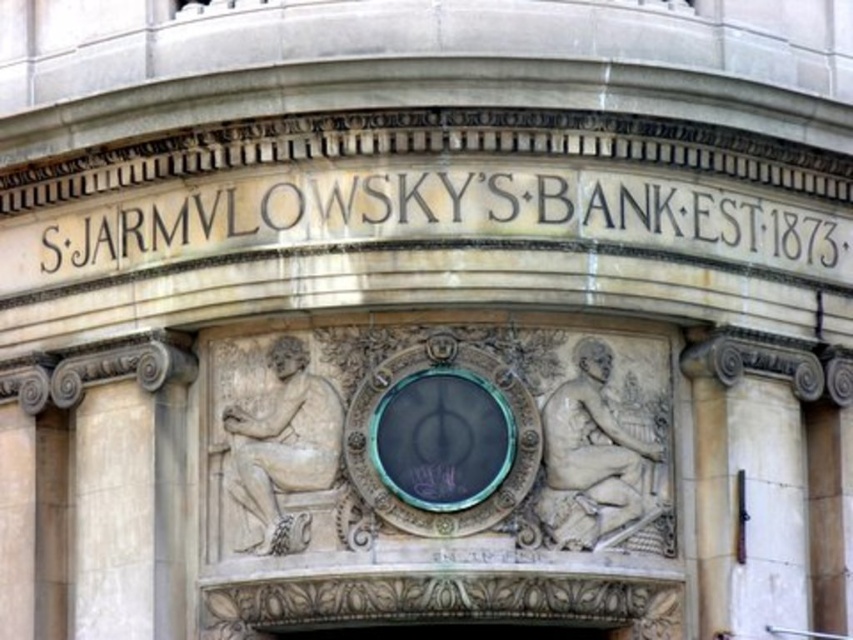
Does green glass clock at center have a lesser width compared to white marble statue at center?

In fact, green glass clock at center might be wider than white marble statue at center.

Which is in front, point (494, 497) or point (305, 541)?

Positioned in front is point (494, 497).

Between point (393, 380) and point (297, 392), which one is positioned behind?

The point (297, 392) is behind.

Locate an element on the screen. This screenshot has height=640, width=853. green glass clock at center is located at coordinates pyautogui.click(x=442, y=438).

Does white marble statue at center have a larger size compared to black glass door at center?

Correct, white marble statue at center is larger in size than black glass door at center.

Does white marble statue at center appear under black glass door at center?

No, white marble statue at center is not below black glass door at center.

Locate an element on the screen. white marble statue at center is located at coordinates (282, 448).

From the picture: Does green glass clock at center appear under black glass door at center?

Incorrect, green glass clock at center is not positioned below black glass door at center.

From the picture: Is green glass clock at center taller than black glass door at center?

Yes, green glass clock at center is taller than black glass door at center.

I want to click on green glass clock at center, so click(442, 438).

Find the location of `green glass clock at center`. green glass clock at center is located at coordinates (442, 438).